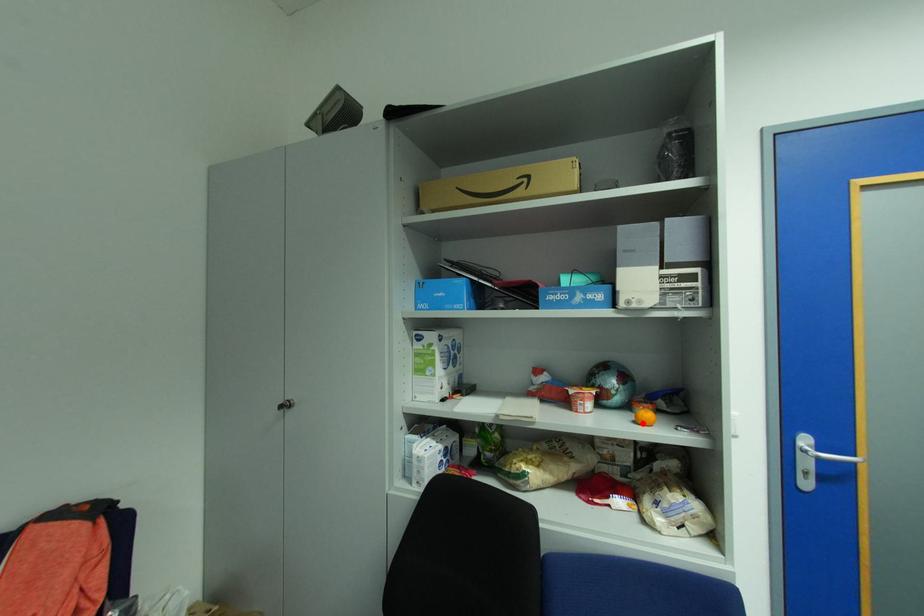
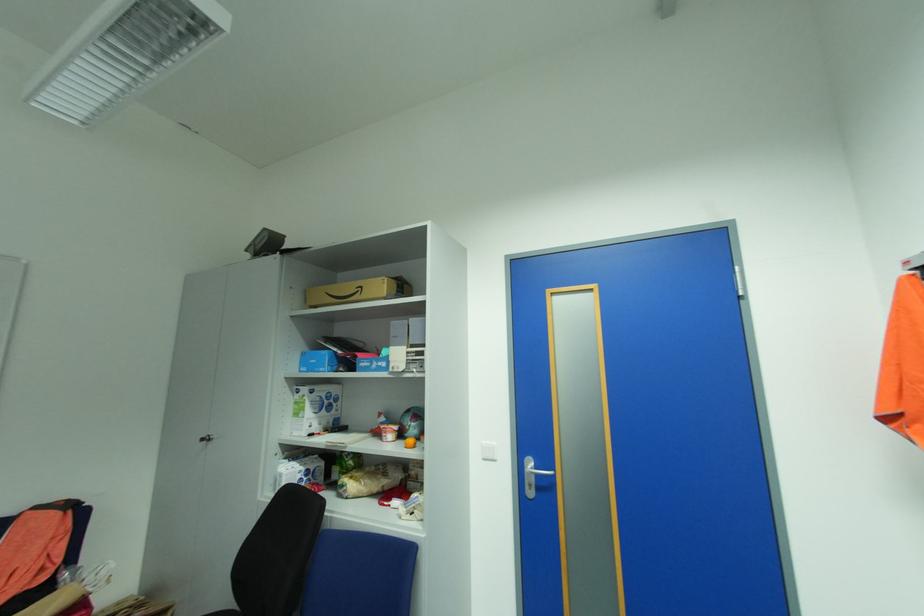
In the second image, find the point that corresponds to the highlighted location in the first image.

(412, 447)